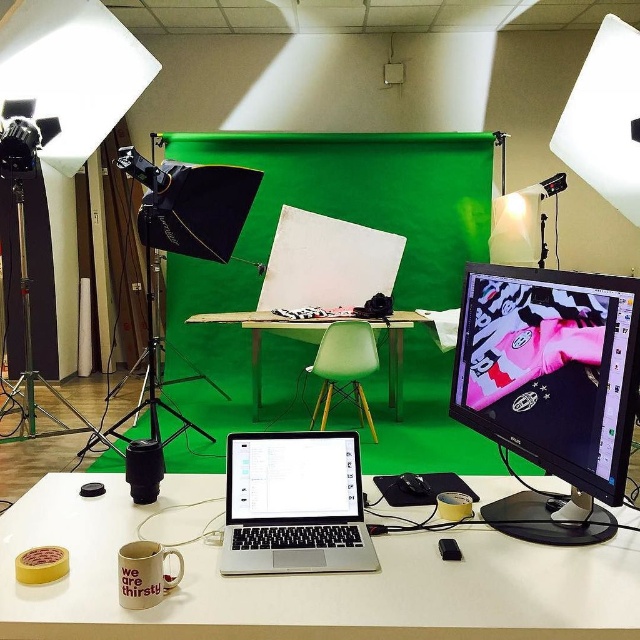
Can you confirm if white matte table at center is positioned to the left of matte black monitor at right?

Correct, you'll find white matte table at center to the left of matte black monitor at right.

Is white matte table at center shorter than matte black monitor at right?

Indeed, white matte table at center has a lesser height compared to matte black monitor at right.

Describe the element at coordinates (304, 579) in the screenshot. This screenshot has width=640, height=640. I see `white matte table at center` at that location.

Image resolution: width=640 pixels, height=640 pixels. I want to click on white matte table at center, so click(x=304, y=579).

Who is more distant from viewer, (x=230, y=314) or (x=131, y=588)?

The point (x=230, y=314) is more distant.

Between green plastic chair at center and matte beige mug at lower left, which one appears on the right side from the viewer's perspective?

Positioned to the right is matte beige mug at lower left.

What do you see at coordinates (260, 339) in the screenshot? This screenshot has width=640, height=640. I see `green plastic chair at center` at bounding box center [260, 339].

What are the coordinates of `green plastic chair at center` in the screenshot? It's located at (260, 339).

Does silver metallic laptop at center have a lesser height compared to green plastic chair at center?

Indeed, silver metallic laptop at center has a lesser height compared to green plastic chair at center.

The height and width of the screenshot is (640, 640). Identify the location of silver metallic laptop at center. (294, 504).